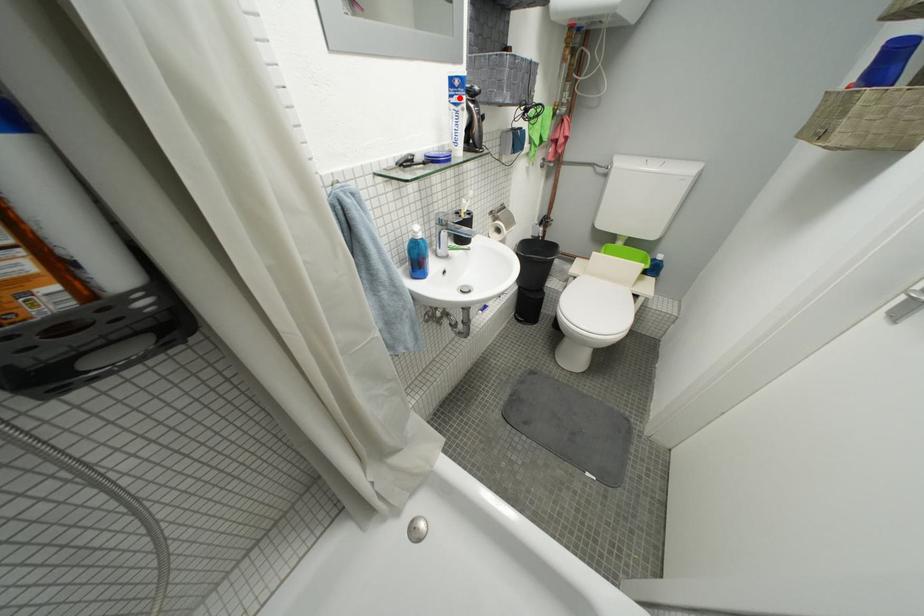
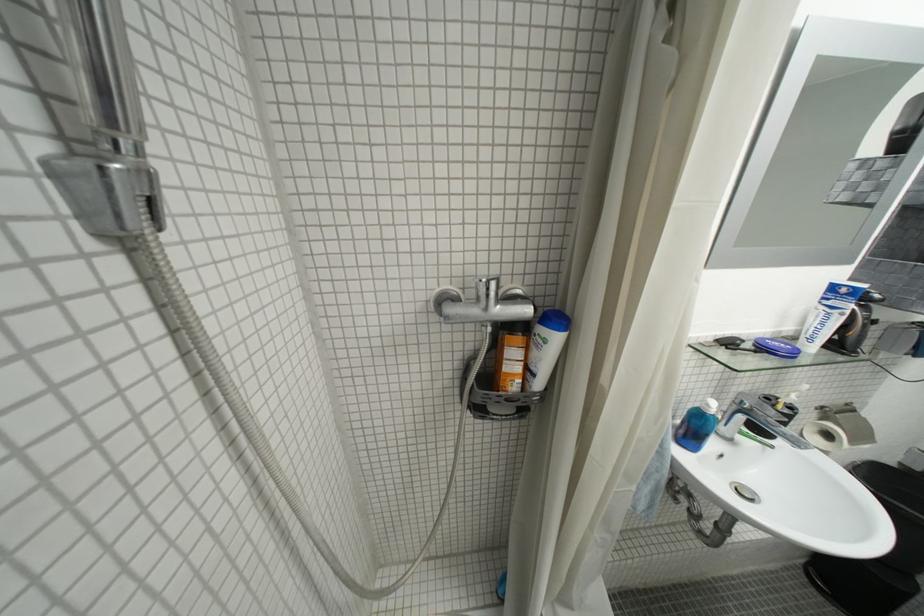
In the second image, find the point that corresponds to the highlighted location in the first image.

(833, 301)